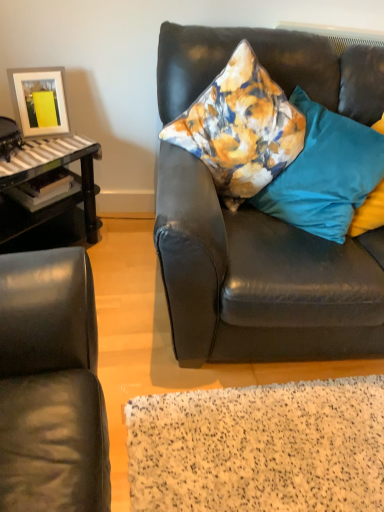
Question: From the image's perspective, would you say teal fabric pillow at right, the 3th pillow in the left-to-right sequence, is positioned over velvet floral pillow at center, which is the second pillow from right to left?

Choices:
 (A) no
 (B) yes

Answer: (B)

Question: Is teal fabric pillow at right, the 3th pillow in the left-to-right sequence, completely or partially outside of velvet floral pillow at center, which appears as the 2th pillow when viewed from the left?

Choices:
 (A) yes
 (B) no

Answer: (A)

Question: Does teal fabric pillow at right, the 3th pillow in the left-to-right sequence, have a lesser height compared to velvet floral pillow at center, which appears as the 2th pillow when viewed from the left?

Choices:
 (A) yes
 (B) no

Answer: (A)

Question: From the image's perspective, is teal fabric pillow at right, which is the 1th pillow in right-to-left order, under velvet floral pillow at center, which is the second pillow from right to left?

Choices:
 (A) yes
 (B) no

Answer: (B)

Question: From a real-world perspective, is teal fabric pillow at right, the 3th pillow in the left-to-right sequence, over velvet floral pillow at center, which appears as the 2th pillow when viewed from the left?

Choices:
 (A) yes
 (B) no

Answer: (B)

Question: Considering the relative positions of teal fabric pillow at right, which is the 1th pillow in right-to-left order, and velvet floral pillow at center, which is the second pillow from right to left, in the image provided, is teal fabric pillow at right, which is the 1th pillow in right-to-left order, behind velvet floral pillow at center, which is the second pillow from right to left,?

Choices:
 (A) no
 (B) yes

Answer: (B)

Question: Is velvet floral pillow at center, which is the second pillow from right to left, further to the viewer compared to matte white picture frame at upper left?

Choices:
 (A) no
 (B) yes

Answer: (A)

Question: Is velvet floral pillow at center, which appears as the 2th pillow when viewed from the left, beside matte white picture frame at upper left?

Choices:
 (A) yes
 (B) no

Answer: (B)

Question: Is velvet floral pillow at center, which is the second pillow from right to left, bigger than matte white picture frame at upper left?

Choices:
 (A) no
 (B) yes

Answer: (B)

Question: Does velvet floral pillow at center, which is the second pillow from right to left, have a lesser height compared to matte white picture frame at upper left?

Choices:
 (A) no
 (B) yes

Answer: (A)

Question: Is matte white picture frame at upper left a part of velvet floral pillow at center, which is the second pillow from right to left?

Choices:
 (A) yes
 (B) no

Answer: (B)

Question: From a real-world perspective, is velvet floral pillow at center, which appears as the 2th pillow when viewed from the left, on top of matte white picture frame at upper left?

Choices:
 (A) no
 (B) yes

Answer: (A)

Question: Is teal fabric pillow at right, the 3th pillow in the left-to-right sequence, oriented away from floral fabric pillow at upper right, acting as the first pillow starting from the left?

Choices:
 (A) no
 (B) yes

Answer: (A)